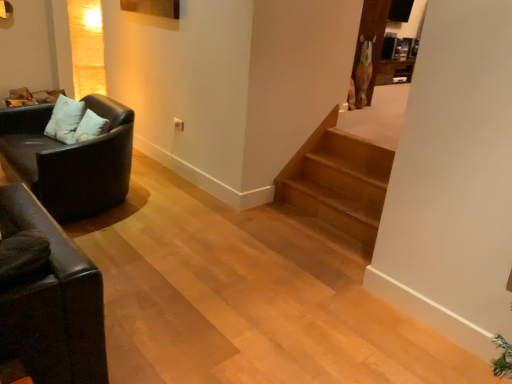
Question: Does light brown wooden stairs at center lie behind matte black couch at left?

Choices:
 (A) yes
 (B) no

Answer: (A)

Question: Considering the relative sizes of light brown wooden stairs at center and matte black couch at left in the image provided, is light brown wooden stairs at center taller than matte black couch at left?

Choices:
 (A) no
 (B) yes

Answer: (A)

Question: Is light brown wooden stairs at center oriented away from matte black couch at left?

Choices:
 (A) no
 (B) yes

Answer: (A)

Question: Considering the relative sizes of light brown wooden stairs at center and matte black couch at left in the image provided, is light brown wooden stairs at center smaller than matte black couch at left?

Choices:
 (A) no
 (B) yes

Answer: (B)

Question: Is light brown wooden stairs at center in contact with matte black couch at left?

Choices:
 (A) no
 (B) yes

Answer: (A)

Question: Is matte black couch at left in front of or behind light brown wooden stairs at center in the image?

Choices:
 (A) front
 (B) behind

Answer: (A)

Question: From the image's perspective, is matte black couch at left located above or below light brown wooden stairs at center?

Choices:
 (A) below
 (B) above

Answer: (B)

Question: From a real-world perspective, is matte black couch at left positioned above or below light brown wooden stairs at center?

Choices:
 (A) above
 (B) below

Answer: (A)

Question: Based on their positions, is matte black couch at left located to the left or right of light brown wooden stairs at center?

Choices:
 (A) right
 (B) left

Answer: (B)

Question: In terms of width, does white soft pillow at left look wider or thinner when compared to matte black couch at left?

Choices:
 (A) wide
 (B) thin

Answer: (B)

Question: Is white soft pillow at left spatially inside matte black couch at left, or outside of it?

Choices:
 (A) inside
 (B) outside

Answer: (A)

Question: Based on their positions, is white soft pillow at left located to the left or right of matte black couch at left?

Choices:
 (A) right
 (B) left

Answer: (B)

Question: Considering the positions of point (80, 109) and point (49, 104), is point (80, 109) closer or farther from the camera than point (49, 104)?

Choices:
 (A) farther
 (B) closer

Answer: (B)

Question: From a real-world perspective, is matte black couch at left above or below white soft pillow at left?

Choices:
 (A) below
 (B) above

Answer: (A)

Question: From their relative heights in the image, would you say matte black couch at left is taller or shorter than white soft pillow at left?

Choices:
 (A) short
 (B) tall

Answer: (B)